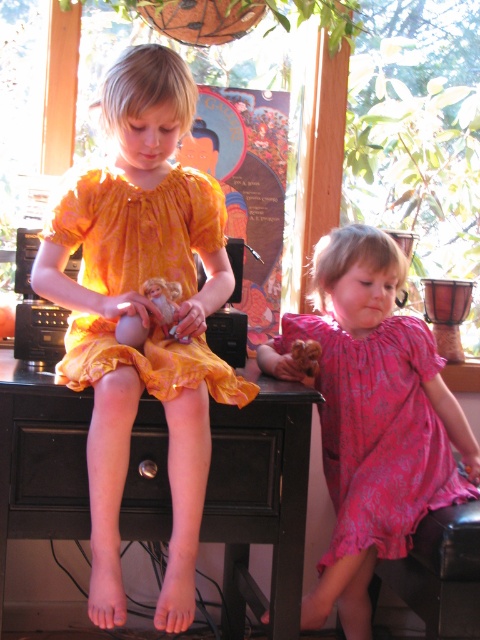
Question: Which object is the farthest from the orange satin dress at center?

Choices:
 (A) pink floral dress at lower right
 (B) orange printed dress at center
 (C) matte pink doll at center

Answer: (A)

Question: Where is pink floral dress at lower right located in relation to matte pink doll at center in the image?

Choices:
 (A) below
 (B) above

Answer: (A)

Question: Does black wood table at center have a smaller size compared to matte pink doll at center?

Choices:
 (A) yes
 (B) no

Answer: (B)

Question: Which of the following is the closest to the observer?

Choices:
 (A) orange satin dress at center
 (B) pink floral dress at lower right
 (C) matte pink doll at center
 (D) black wood table at center

Answer: (A)

Question: Estimate the real-world distances between objects in this image. Which object is farther from the matte pink doll at center?

Choices:
 (A) orange printed dress at center
 (B) orange satin dress at center
 (C) pink floral dress at lower right

Answer: (C)

Question: Can you confirm if orange printed dress at center is positioned above matte pink doll at center?

Choices:
 (A) no
 (B) yes

Answer: (B)